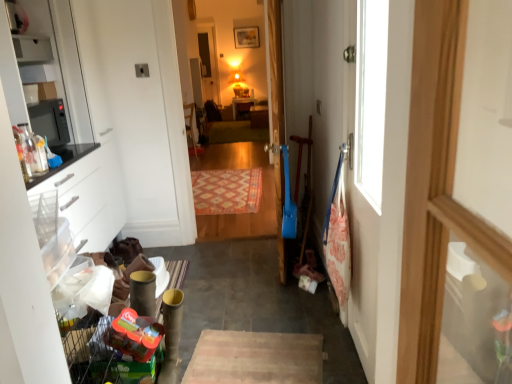
Question: From a real-world perspective, is green carpet at center, which is the second mat from bottom to top, located higher than translucent plastic toy at lower left?

Choices:
 (A) yes
 (B) no

Answer: (B)

Question: Would you consider green carpet at center, the first mat from the back, to be distant from translucent plastic toy at lower left?

Choices:
 (A) yes
 (B) no

Answer: (A)

Question: Can you confirm if green carpet at center, acting as the 1th mat starting from the top, is smaller than translucent plastic toy at lower left?

Choices:
 (A) yes
 (B) no

Answer: (B)

Question: Considering the relative positions of green carpet at center, which is counted as the second mat, starting from the front, and translucent plastic toy at lower left in the image provided, is green carpet at center, which is counted as the second mat, starting from the front, behind translucent plastic toy at lower left?

Choices:
 (A) no
 (B) yes

Answer: (B)

Question: From the image's perspective, is green carpet at center, which is counted as the second mat, starting from the front, above translucent plastic toy at lower left?

Choices:
 (A) yes
 (B) no

Answer: (A)

Question: From a real-world perspective, is green carpet at center, acting as the 1th mat starting from the top, beneath translucent plastic toy at lower left?

Choices:
 (A) yes
 (B) no

Answer: (A)

Question: Does green carpet at center, which is counted as the second mat, starting from the front, have a lesser width compared to matte white shelf at upper left?

Choices:
 (A) yes
 (B) no

Answer: (B)

Question: From the image's perspective, would you say green carpet at center, acting as the 1th mat starting from the top, is shown under matte white shelf at upper left?

Choices:
 (A) yes
 (B) no

Answer: (B)

Question: Can you confirm if green carpet at center, which is the second mat from bottom to top, is smaller than matte white shelf at upper left?

Choices:
 (A) yes
 (B) no

Answer: (B)

Question: Can you confirm if green carpet at center, which is the second mat from bottom to top, is shorter than matte white shelf at upper left?

Choices:
 (A) no
 (B) yes

Answer: (B)

Question: Does green carpet at center, the first mat from the back, appear on the left side of matte white shelf at upper left?

Choices:
 (A) no
 (B) yes

Answer: (A)

Question: Is green carpet at center, acting as the 1th mat starting from the top, facing away from matte white shelf at upper left?

Choices:
 (A) no
 (B) yes

Answer: (A)

Question: From a real-world perspective, does orange woven rug at center, the 1th mat when ordered from front to back, stand above translucent plastic toy at lower left?

Choices:
 (A) no
 (B) yes

Answer: (A)